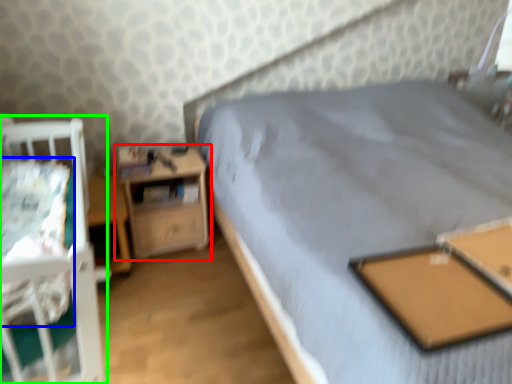
Question: Based on their relative distances, which object is nearer to nightstand (highlighted by a red box)? Choose from sheet (highlighted by a blue box) and infant bed (highlighted by a green box).

Choices:
 (A) sheet
 (B) infant bed

Answer: (B)